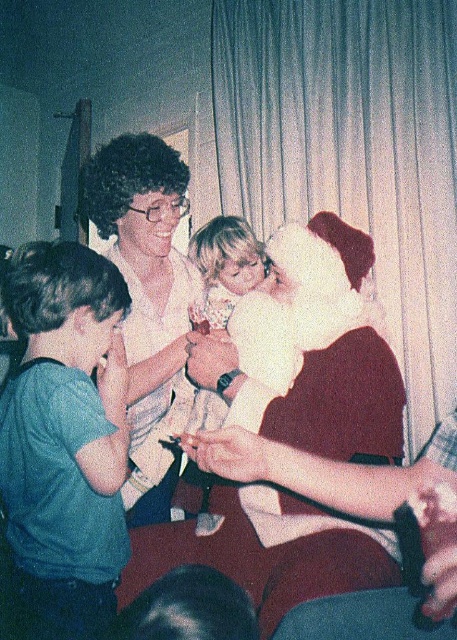
Does white matte shirt at center have a lesser height compared to smooth white dress at center?

No, white matte shirt at center is not shorter than smooth white dress at center.

Locate an element on the screen. white matte shirt at center is located at coordinates (147, 291).

Does point (181, 273) lie in front of point (136, 518)?

Yes, it is.

Locate an element on the screen. white matte shirt at center is located at coordinates (147, 291).